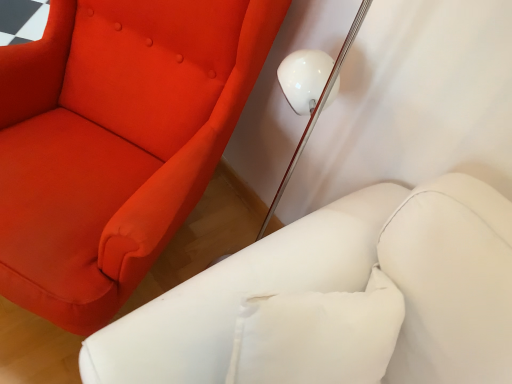
Question: Should I look upward or downward to see matte red fabric chair at upper left?

Choices:
 (A) down
 (B) up

Answer: (B)

Question: Is matte red fabric chair at upper left behind white leather armchair at lower right?

Choices:
 (A) yes
 (B) no

Answer: (A)

Question: Can you confirm if matte red fabric chair at upper left is positioned to the left of white leather armchair at lower right?

Choices:
 (A) yes
 (B) no

Answer: (A)

Question: From the image's perspective, would you say matte red fabric chair at upper left is shown under white leather armchair at lower right?

Choices:
 (A) yes
 (B) no

Answer: (B)

Question: Considering the relative sizes of matte red fabric chair at upper left and white leather armchair at lower right in the image provided, is matte red fabric chair at upper left wider than white leather armchair at lower right?

Choices:
 (A) yes
 (B) no

Answer: (A)

Question: Is matte red fabric chair at upper left oriented towards white leather armchair at lower right?

Choices:
 (A) no
 (B) yes

Answer: (A)

Question: From the image's perspective, would you say matte red fabric chair at upper left is positioned over white leather armchair at lower right?

Choices:
 (A) no
 (B) yes

Answer: (B)

Question: Does white leather armchair at lower right lie behind matte red fabric chair at upper left?

Choices:
 (A) no
 (B) yes

Answer: (A)

Question: From a real-world perspective, is white leather armchair at lower right on matte red fabric chair at upper left?

Choices:
 (A) yes
 (B) no

Answer: (A)

Question: Does white leather armchair at lower right have a lesser width compared to matte red fabric chair at upper left?

Choices:
 (A) no
 (B) yes

Answer: (B)

Question: Can we say white leather armchair at lower right lies outside matte red fabric chair at upper left?

Choices:
 (A) yes
 (B) no

Answer: (A)

Question: Is white leather armchair at lower right at the left side of matte red fabric chair at upper left?

Choices:
 (A) no
 (B) yes

Answer: (A)

Question: Are white leather armchair at lower right and matte red fabric chair at upper left far apart?

Choices:
 (A) no
 (B) yes

Answer: (A)

Question: From a real-world perspective, is matte red fabric chair at upper left physically located above or below white leather armchair at lower right?

Choices:
 (A) above
 (B) below

Answer: (B)